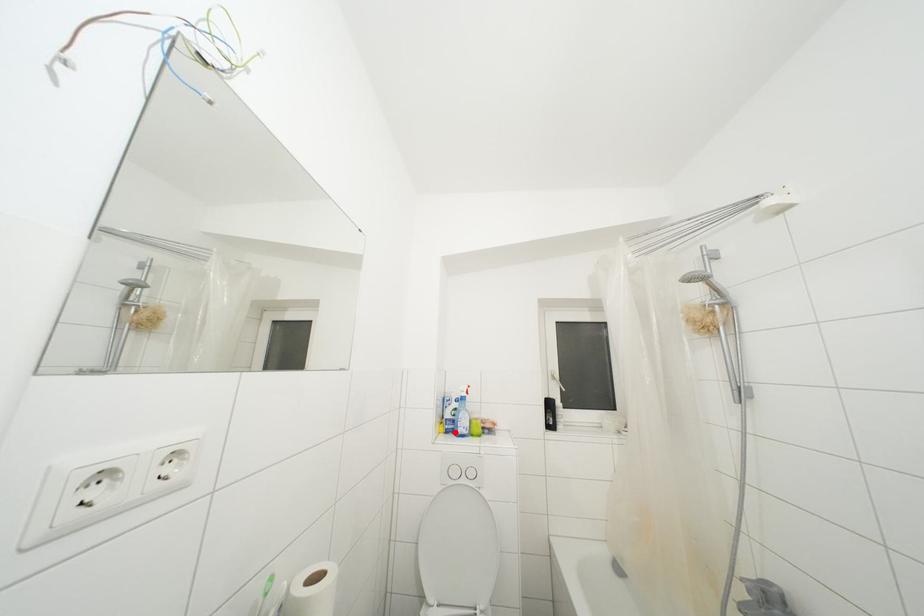
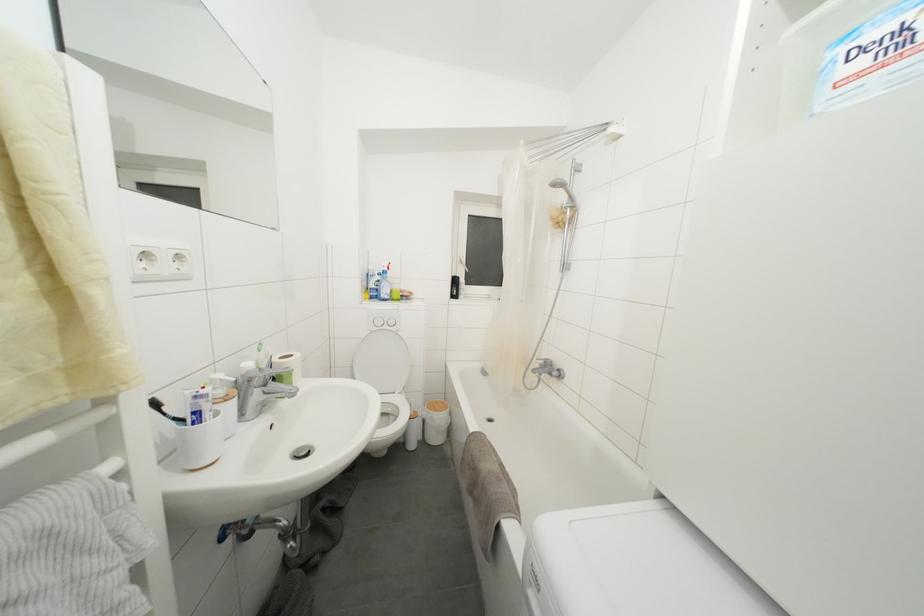
Question: I am providing you with two images of the same scene from different viewpoints. Given a red point in image1, look at the same physical point in image2. Is it:

Choices:
 (A) Closer to the viewpoint
 (B) Farther from the viewpoint

Answer: (A)